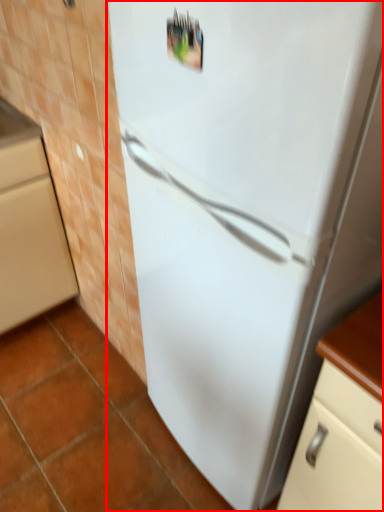
Question: From the image's perspective, what is the correct spatial positioning of refrigerator (annotated by the red box) in reference to cabinetry?

Choices:
 (A) above
 (B) below

Answer: (B)